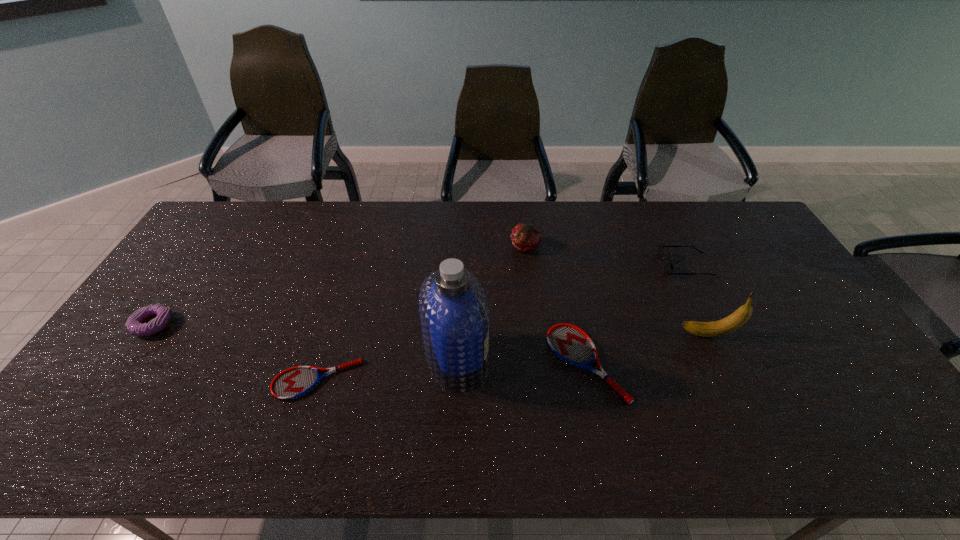
Locate an element on the screen. The height and width of the screenshot is (540, 960). the sixth object from right to left is located at coordinates (292, 383).

This screenshot has width=960, height=540. Identify the location of the left tennis racket. (292, 383).

Locate an element on the screen. the taller tennis racket is located at coordinates (568, 342).

Find the location of a particular element. This screenshot has height=540, width=960. the right tennis racket is located at coordinates (568, 342).

This screenshot has width=960, height=540. What are the coordinates of `the third tallest object` in the screenshot? It's located at (525, 237).

The height and width of the screenshot is (540, 960). I want to click on banana, so click(732, 322).

Identify the location of sunglasses. pos(668,265).

Locate an element on the screen. The image size is (960, 540). the leftmost object is located at coordinates (135, 324).

Identify the location of the third shortest object. (135, 324).

What are the coordinates of `the third object from left to right` in the screenshot? It's located at (454, 310).